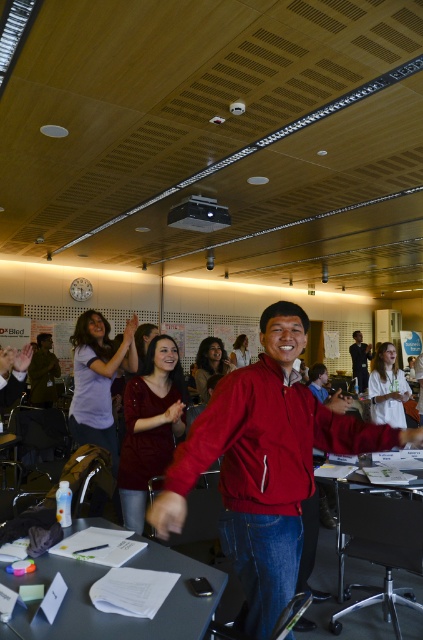
You are standing in the conference room and see two points marked in the scene. Which point is closer to you, point (169, 609) or point (357, 339)?

Point (169, 609) is in front of point (357, 339), so it is closer to you.

You are a photographer standing in the conference room and want to take a photo of the matte red jacket at center and the white paper at center. Which object should you focus on first to ensure both are in sharp focus?

Since the matte red jacket at center is closer to you than the white paper at center, you should focus on the matte red jacket at center first. This ensures that both objects will be in focus as the white paper at center is behind the jacket.

You are a person who is 1.7 meters tall and standing in the conference room. You want to approach the matte red jacket at center to shake hands with the person wearing it. Considering your height, do you think you can comfortably reach their hand without needing to jump?

The distance between you and the matte red jacket at center is 1.52 meters. Since the average comfortable reaching distance for a handshake is about 1.5 meters, you can comfortably reach their hand without needing to jump.